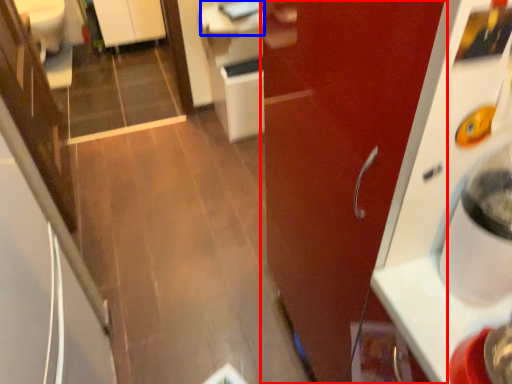
Question: Which of the following is the farthest to the observer, door (highlighted by a red box) or counter top (highlighted by a blue box)?

Choices:
 (A) door
 (B) counter top

Answer: (B)